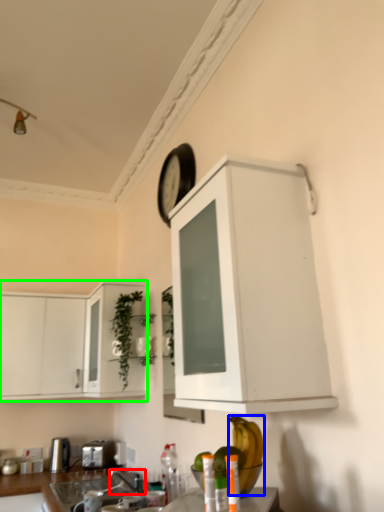
Question: Based on their relative distances, which object is nearer to faucet (highlighted by a red box)? Choose from banana (highlighted by a blue box) and cabinetry (highlighted by a green box).

Choices:
 (A) banana
 (B) cabinetry

Answer: (B)